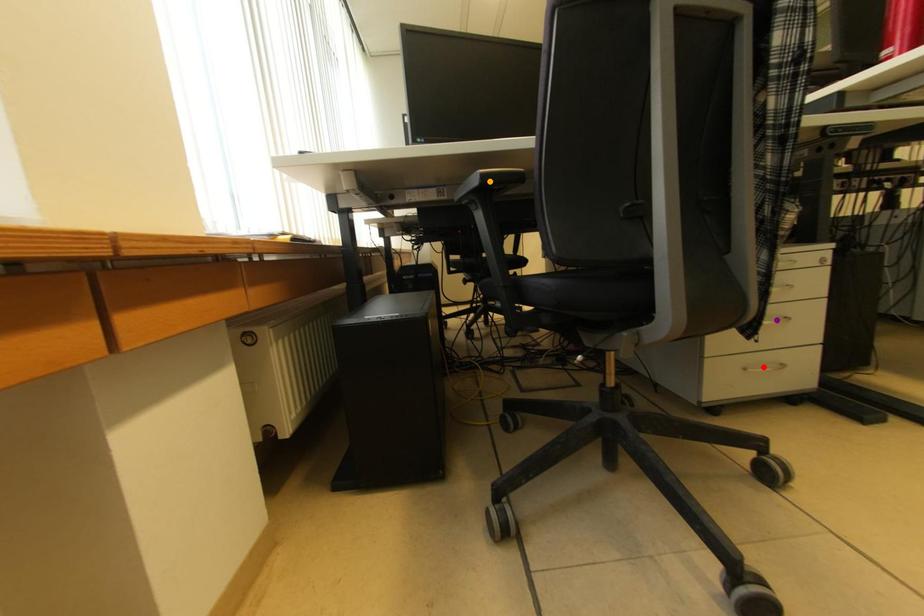
Order these from nearest to farthest:
A) purple point
B) red point
C) orange point

orange point
purple point
red point